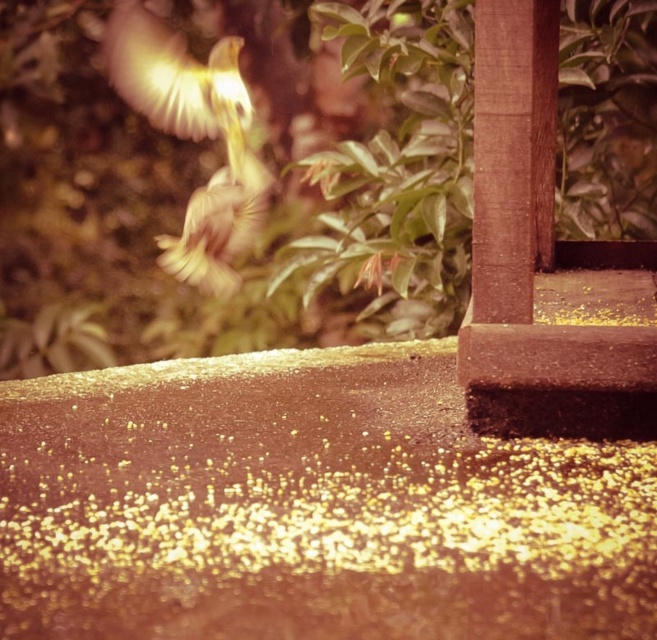
Question: Which of the following is the closest to the observer?

Choices:
 (A) (238, 198)
 (B) (204, 118)

Answer: (B)

Question: Among these objects, which one is nearest to the camera?

Choices:
 (A) translucent yellow bird at upper left
 (B) light brown feathers at center

Answer: (A)

Question: Does translucent yellow bird at upper left appear under light brown feathers at center?

Choices:
 (A) no
 (B) yes

Answer: (A)

Question: Where is translucent yellow bird at upper left located in relation to light brown feathers at center in the image?

Choices:
 (A) right
 (B) left

Answer: (B)

Question: Can you confirm if translucent yellow bird at upper left is bigger than light brown feathers at center?

Choices:
 (A) yes
 (B) no

Answer: (A)

Question: Among these objects, which one is farthest from the camera?

Choices:
 (A) light brown feathers at center
 (B) translucent yellow bird at upper left

Answer: (A)